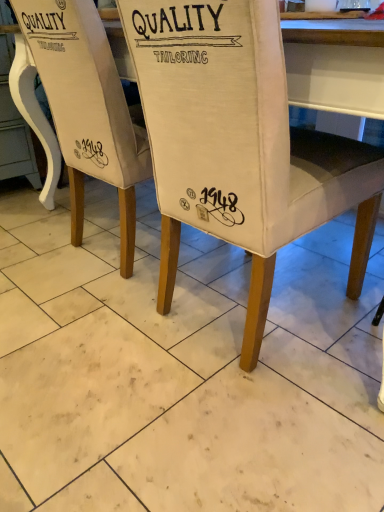
This screenshot has width=384, height=512. What are the coordinates of `vacant region under white fabric chair at center, marked as the second chair in a left-to-right arrangement (from a real-world perspective)` in the screenshot? It's located at (242, 313).